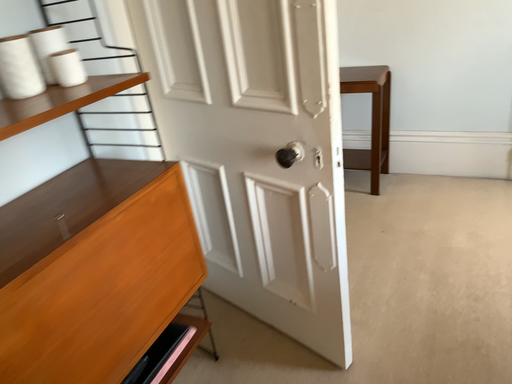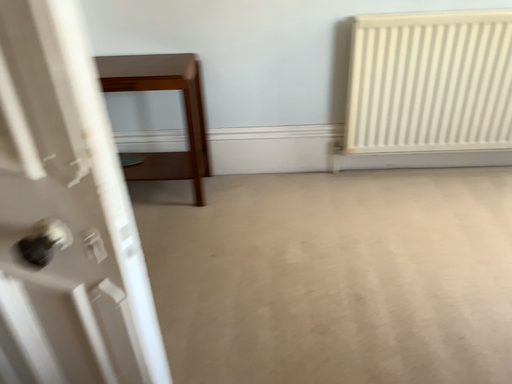
Question: Which way did the camera rotate in the video?

Choices:
 (A) rotated left
 (B) rotated right

Answer: (B)